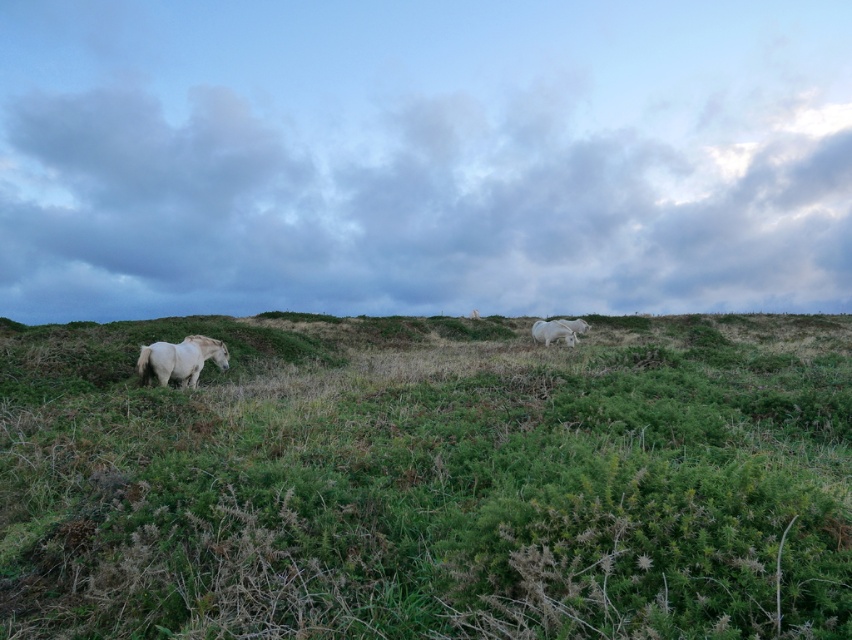
Question: Which point is closer to the camera?

Choices:
 (A) white matte horse at upper center
 (B) green grassy at center

Answer: (B)

Question: Which point is closer to the camera taking this photo?

Choices:
 (A) (102, 396)
 (B) (199, 369)

Answer: (A)

Question: Does white matte horse at left have a larger size compared to white matte horse at upper center?

Choices:
 (A) yes
 (B) no

Answer: (A)

Question: Which object is farther from the camera taking this photo?

Choices:
 (A) white matte horse at center
 (B) white matte horse at upper center
 (C) green grassy at center

Answer: (A)

Question: Is green grassy at center bigger than white matte horse at center?

Choices:
 (A) no
 (B) yes

Answer: (B)

Question: Is white matte horse at left in front of white matte horse at center?

Choices:
 (A) yes
 (B) no

Answer: (A)